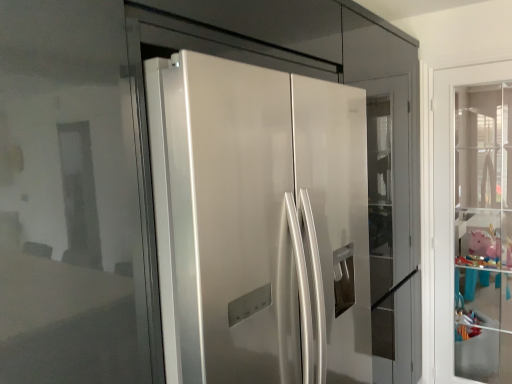
Identify the location of glossy white refrigerator at center, which appears as the 2th door when viewed from the right. (259, 223).

What do you see at coordinates (259, 223) in the screenshot? I see `glossy white refrigerator at center, which ranks as the 1th door in front-to-back order` at bounding box center [259, 223].

Where is `pink matte piggy bank at right`? The height and width of the screenshot is (384, 512). pink matte piggy bank at right is located at coordinates (489, 246).

At what (x,y) coordinates should I click in order to perform the action: click on door lying above the glossy white refrigerator at center, which is counted as the 1th door, starting from the left (from the image's perspective). Please return your answer as a coordinate pair (x, y). Looking at the image, I should click on (448, 197).

Can you tell me how much glossy white refrigerator at center, which ranks as the 1th door in front-to-back order, and clear glass door at right, the 1th door from the right, differ in facing direction?

The angular difference between glossy white refrigerator at center, which ranks as the 1th door in front-to-back order, and clear glass door at right, the 1th door from the right, is 90.5 degrees.

In the scene shown: Is glossy white refrigerator at center, which ranks as the 1th door in front-to-back order, wider than clear glass door at right, the 1th door from the right?

Yes, glossy white refrigerator at center, which ranks as the 1th door in front-to-back order, is wider than clear glass door at right, the 1th door from the right.

Consider the image. Would you say glossy white refrigerator at center, which ranks as the 1th door in front-to-back order, is a long distance from clear glass door at right, which is counted as the first door, starting from the back?

That's right, there is a large distance between glossy white refrigerator at center, which ranks as the 1th door in front-to-back order, and clear glass door at right, which is counted as the first door, starting from the back.

Can you confirm if clear glass door at right, the 1th door from the right, is positioned to the left of pink matte piggy bank at right?

Yes.

Does point (448, 245) come closer to viewer compared to point (488, 253)?

That is True.

Can you confirm if clear glass door at right, which is counted as the first door, starting from the back, is smaller than pink matte piggy bank at right?

Indeed, clear glass door at right, which is counted as the first door, starting from the back, has a smaller size compared to pink matte piggy bank at right.

What's the angular difference between clear glass door at right, the 1th door from the right, and pink matte piggy bank at right's facing directions?

0.766 degrees.

Is glossy white refrigerator at center, which ranks as the 1th door in front-to-back order, taller or shorter than pink matte piggy bank at right?

In the image, glossy white refrigerator at center, which ranks as the 1th door in front-to-back order, appears to be taller than pink matte piggy bank at right.

Is pink matte piggy bank at right surrounded by glossy white refrigerator at center, which is counted as the 1th door, starting from the left?

Definitely not — pink matte piggy bank at right is not inside glossy white refrigerator at center, which is counted as the 1th door, starting from the left.

Consider the image. Is glossy white refrigerator at center, which appears as the 2th door when viewed from the right, aimed at pink matte piggy bank at right?

No, glossy white refrigerator at center, which appears as the 2th door when viewed from the right, is not oriented towards pink matte piggy bank at right.

Are pink matte piggy bank at right and clear glass door at right, which is counted as the first door, starting from the back, located far from each other?

Yes, pink matte piggy bank at right and clear glass door at right, which is counted as the first door, starting from the back, are quite far apart.

Between pink matte piggy bank at right and clear glass door at right, which is counted as the first door, starting from the back, which one has smaller width?

With smaller width is clear glass door at right, which is counted as the first door, starting from the back.

How many degrees apart are the facing directions of pink matte piggy bank at right and clear glass door at right, the 1th door from the right?

pink matte piggy bank at right and clear glass door at right, the 1th door from the right, are facing 0.766 degrees away from each other.

Considering the relative positions of pink matte piggy bank at right and glossy white refrigerator at center, which is counted as the 1th door, starting from the left, in the image provided, is pink matte piggy bank at right to the left or to the right of glossy white refrigerator at center, which is counted as the 1th door, starting from the left,?

Clearly, pink matte piggy bank at right is on the right of glossy white refrigerator at center, which is counted as the 1th door, starting from the left, in the image.

Who is more distant, pink matte piggy bank at right or glossy white refrigerator at center, which ranks as the 1th door in front-to-back order?

pink matte piggy bank at right is further away from the camera.

The image size is (512, 384). I want to click on toy below the glossy white refrigerator at center, which appears as the 2th door when viewed from the right (from a real-world perspective), so click(x=489, y=246).

Which of these two, pink matte piggy bank at right or glossy white refrigerator at center, the 2th door viewed from the back, stands taller?

Standing taller between the two is glossy white refrigerator at center, the 2th door viewed from the back.

From a real-world perspective, which is physically above, clear glass door at right, the 2th door in the front-to-back sequence, or glossy white refrigerator at center, which is counted as the 1th door, starting from the left?

In real-world perspective, glossy white refrigerator at center, which is counted as the 1th door, starting from the left, is above.

Would you consider clear glass door at right, the 1th door from the right, to be distant from glossy white refrigerator at center, which is counted as the 1th door, starting from the left?

clear glass door at right, the 1th door from the right, is positioned a significant distance from glossy white refrigerator at center, which is counted as the 1th door, starting from the left.

Can you confirm if clear glass door at right, the 1th door from the right, is taller than glossy white refrigerator at center, the 2th door viewed from the back?

Yes, clear glass door at right, the 1th door from the right, is taller than glossy white refrigerator at center, the 2th door viewed from the back.

Locate an element on the screen. The image size is (512, 384). door below the clear glass door at right, the 2th door in the front-to-back sequence (from the image's perspective) is located at coordinates (259, 223).

Image resolution: width=512 pixels, height=384 pixels. What are the coordinates of `toy behind the clear glass door at right, the 1th door from the right` in the screenshot? It's located at (489, 246).

Estimate the real-world distances between objects in this image. Which object is further from pink matte piggy bank at right, clear glass door at right, the 2th door in the front-to-back sequence, or glossy white refrigerator at center, which appears as the 2th door when viewed from the right?

glossy white refrigerator at center, which appears as the 2th door when viewed from the right, lies further to pink matte piggy bank at right than the other object.

Based on their spatial positions, is clear glass door at right, which is counted as the first door, starting from the back, or pink matte piggy bank at right closer to glossy white refrigerator at center, the 2th door viewed from the back?

Among the two, clear glass door at right, which is counted as the first door, starting from the back, is located nearer to glossy white refrigerator at center, the 2th door viewed from the back.

Looking at the image, which one is located closer to clear glass door at right, which is counted as the first door, starting from the back, glossy white refrigerator at center, which ranks as the 1th door in front-to-back order, or pink matte piggy bank at right?

The object closer to clear glass door at right, which is counted as the first door, starting from the back, is glossy white refrigerator at center, which ranks as the 1th door in front-to-back order.

Looking at the image, which one is located further to clear glass door at right, the 1th door from the right, pink matte piggy bank at right or glossy white refrigerator at center, which ranks as the 1th door in front-to-back order?

The object further to clear glass door at right, the 1th door from the right, is pink matte piggy bank at right.

Based on their spatial positions, is glossy white refrigerator at center, which appears as the 2th door when viewed from the right, or clear glass door at right, the 1th door from the right, further from pink matte piggy bank at right?

Among the two, glossy white refrigerator at center, which appears as the 2th door when viewed from the right, is located further to pink matte piggy bank at right.

Which object lies nearer to the anchor point glossy white refrigerator at center, which is counted as the 1th door, starting from the left, pink matte piggy bank at right or clear glass door at right, which is the second door from left to right?

clear glass door at right, which is the second door from left to right, is closer to glossy white refrigerator at center, which is counted as the 1th door, starting from the left.

The width and height of the screenshot is (512, 384). What are the coordinates of `door between glossy white refrigerator at center, which appears as the 2th door when viewed from the right, and pink matte piggy bank at right from front to back` in the screenshot? It's located at (448, 197).